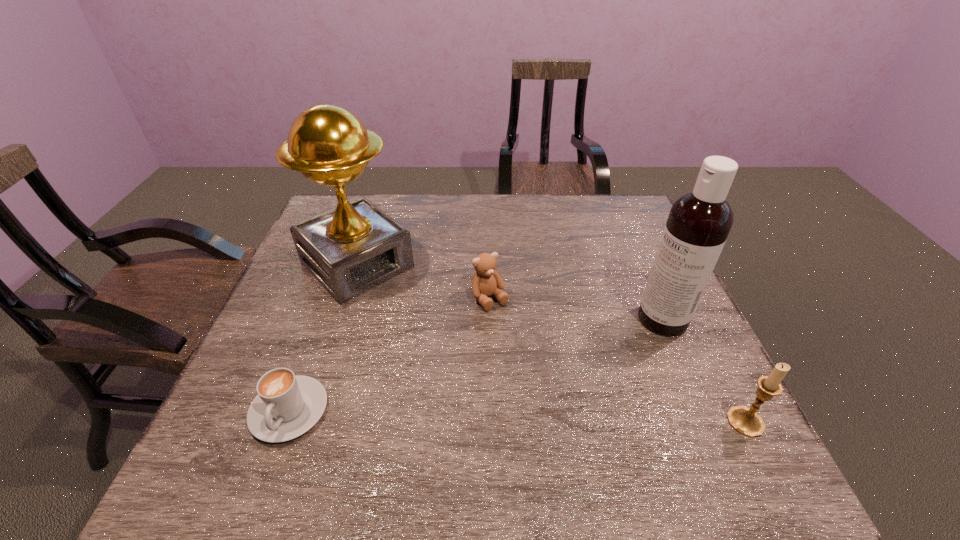
The image size is (960, 540). I want to click on vacant area that lies between the dishwasher detergent and the third tallest object, so click(704, 370).

This screenshot has height=540, width=960. I want to click on vacant point located between the award and the candle holder, so click(x=551, y=343).

Locate which object is the fourth closest to the cappuccino. Please provide its 2D coordinates. Your answer should be formatted as a tuple, i.e. [(x, y)], where the tuple contains the x and y coordinates of a point satisfying the conditions above.

[(746, 421)]

Locate an element on the screen. The width and height of the screenshot is (960, 540). object that stands as the fourth closest to the cappuccino is located at coordinates (746, 421).

Find the location of a particular element. The image size is (960, 540). blank space that satisfies the following two spatial constraints: 1. on the front side of the third object from left to right; 2. on the right side of the award is located at coordinates (346, 299).

I want to click on free space that satisfies the following two spatial constraints: 1. on the front side of the candle holder; 2. on the right side of the fourth tallest object, so click(x=492, y=422).

Locate an element on the screen. This screenshot has height=540, width=960. free point that satisfies the following two spatial constraints: 1. to the right of the shortest object; 2. on the right side of the candle holder is located at coordinates [285, 422].

Identify the location of free space that satisfies the following two spatial constraints: 1. to the right of the third shortest object; 2. on the right side of the shortest object. pos(285,422).